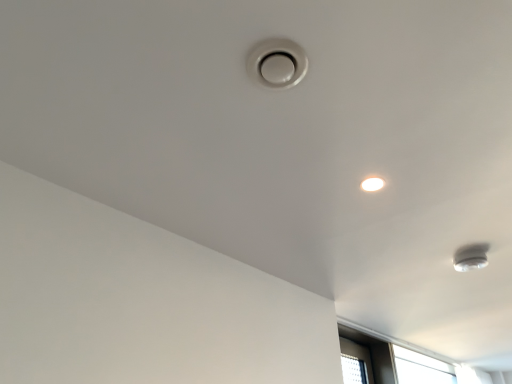
Question: From a real-world perspective, does white glossy lamp at lower right sit lower than white glossy droplight at upper right?

Choices:
 (A) no
 (B) yes

Answer: (B)

Question: Is white glossy lamp at lower right wider than white glossy droplight at upper right?

Choices:
 (A) no
 (B) yes

Answer: (B)

Question: Would you say white glossy lamp at lower right is a long distance from white glossy droplight at upper right?

Choices:
 (A) no
 (B) yes

Answer: (A)

Question: Is white glossy lamp at lower right next to white glossy droplight at upper right and touching it?

Choices:
 (A) no
 (B) yes

Answer: (A)

Question: Is white glossy lamp at lower right thinner than white glossy droplight at upper right?

Choices:
 (A) no
 (B) yes

Answer: (A)

Question: Is white glossy droplight at upper right at the back of white glossy lamp at lower right?

Choices:
 (A) yes
 (B) no

Answer: (B)

Question: Is white glossy droplight at upper right looking in the opposite direction of white glossy lamp at lower right?

Choices:
 (A) no
 (B) yes

Answer: (A)

Question: From the image's perspective, is white glossy droplight at upper right on top of white glossy lamp at lower right?

Choices:
 (A) yes
 (B) no

Answer: (A)

Question: Is white glossy droplight at upper right closer to camera compared to white glossy lamp at lower right?

Choices:
 (A) yes
 (B) no

Answer: (A)

Question: Does white glossy droplight at upper right have a smaller size compared to white glossy lamp at lower right?

Choices:
 (A) no
 (B) yes

Answer: (B)

Question: Is white glossy droplight at upper right thinner than white glossy lamp at lower right?

Choices:
 (A) no
 (B) yes

Answer: (B)

Question: From the image's perspective, is white glossy droplight at upper right below white glossy lamp at lower right?

Choices:
 (A) yes
 (B) no

Answer: (B)

Question: From the image's perspective, is white glossy droplight at upper right above or below white glossy lamp at lower right?

Choices:
 (A) below
 (B) above

Answer: (B)